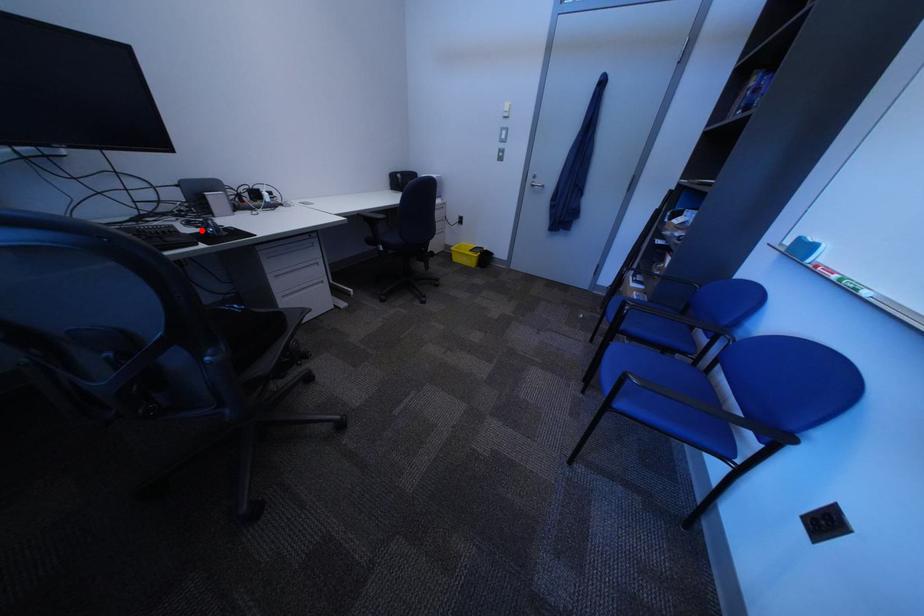
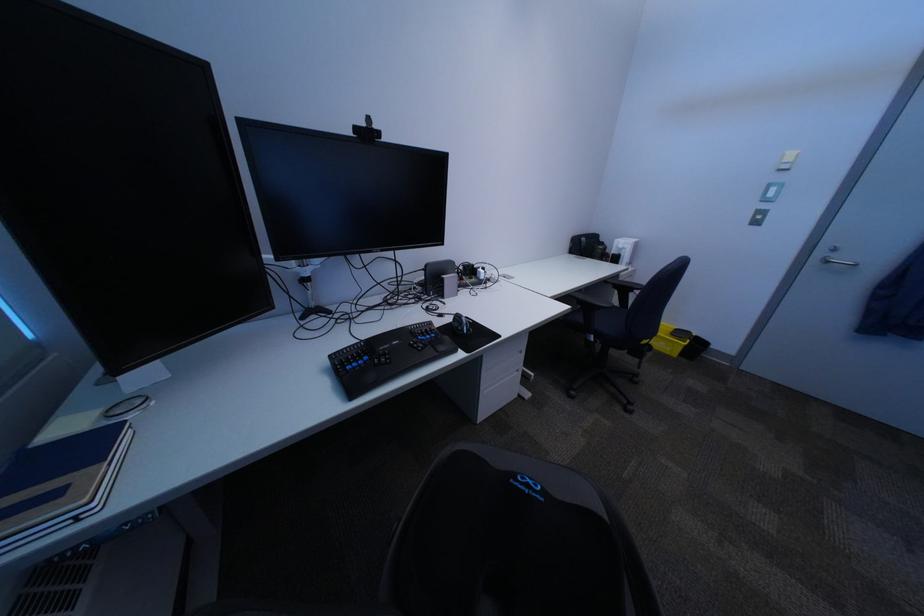
The point at the highlighted location is marked in the first image. Where is the corresponding point in the second image?

(454, 325)